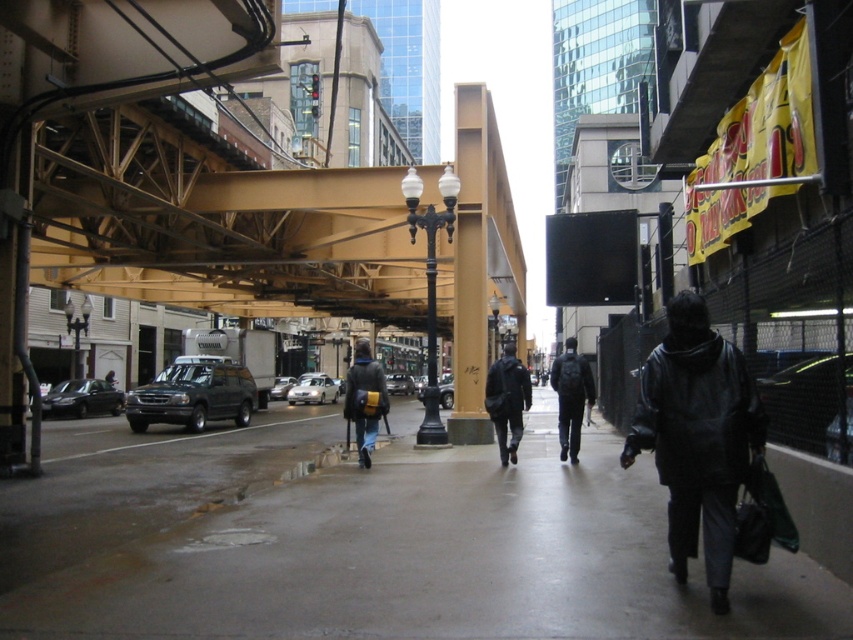
You are standing at the point marked by point (431, 560). Which direction should you walk to reach the yellow steel structure on the left side of the image?

The point (431, 560) marks the concrete sidewalk at center. To reach the yellow steel structure on the left side, you should walk towards the left.

You are a delivery person trying to park your vehicle, which is 2 meters wide. You see the brown wood pillar at center and the matte black suv at center. Can you safely park your vehicle between them without hitting either?

The brown wood pillar at center has a lesser width compared to matte black suv at center. Since the distance between them isn not specified, but the pillar is narrower, it might allow enough space. However, without exact measurements, it is uncertain if 2 meters will fit. Check the actual gap before parking.